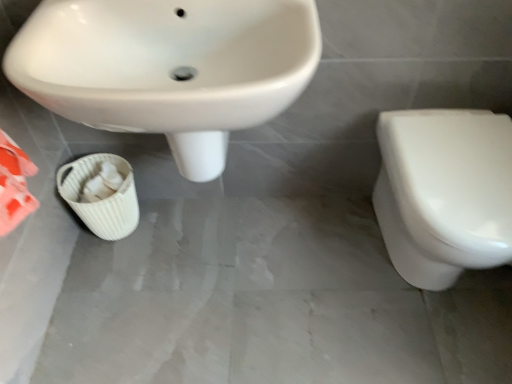
In order to click on white glossy toilet at right in this screenshot , I will do `click(444, 192)`.

At what (x,y) coordinates should I click in order to perform the action: click on white woven basket at lower left. Please return your answer as a coordinate pair (x, y). Looking at the image, I should click on (103, 199).

Find the location of a particular element. white glossy toilet at right is located at coordinates (444, 192).

Would you say white woven basket at lower left is outside white glossy toilet at right?

Absolutely, white woven basket at lower left is external to white glossy toilet at right.

Considering the positions of objects white woven basket at lower left and white glossy toilet at right in the image provided, who is more to the right, white woven basket at lower left or white glossy toilet at right?

white glossy toilet at right is more to the right.

Does white woven basket at lower left turn towards white glossy toilet at right?

No.

Is point (65, 197) positioned before point (429, 115)?

No.

From a real-world perspective, does white glossy toilet at right stand above white glossy sink at upper left?

Incorrect, from a real-world perspective, white glossy toilet at right is lower than white glossy sink at upper left.

The image size is (512, 384). Identify the location of toilet below the white glossy sink at upper left (from a real-world perspective). (444, 192).

Based on their sizes in the image, would you say white glossy toilet at right is bigger or smaller than white glossy sink at upper left?

Clearly, white glossy toilet at right is smaller in size than white glossy sink at upper left.

Is white woven basket at lower left aimed at white glossy sink at upper left?

No, white woven basket at lower left does not turn towards white glossy sink at upper left.

Is white woven basket at lower left in front of or behind white glossy sink at upper left in the image?

Clearly, white woven basket at lower left is behind white glossy sink at upper left.

Can you confirm if white woven basket at lower left is positioned to the right of white glossy sink at upper left?

No.

Which object is thinner, white woven basket at lower left or white glossy sink at upper left?

white woven basket at lower left is thinner.

Does point (445, 133) appear closer or farther from the camera than point (78, 216)?

Point (445, 133).

From the image's perspective, is white glossy toilet at right on white woven basket at lower left?

Incorrect, from the image's perspective, white glossy toilet at right is lower than white woven basket at lower left.

Locate an element on the screen. potty that is on the left side of white glossy toilet at right is located at coordinates (103, 199).

Which of these two, white glossy toilet at right or white woven basket at lower left, is smaller?

white woven basket at lower left is smaller.

From the image's perspective, is white glossy sink at upper left located above or below white glossy toilet at right?

Based on their image positions, white glossy sink at upper left is located above white glossy toilet at right.

Considering the relative sizes of white glossy sink at upper left and white glossy toilet at right in the image provided, is white glossy sink at upper left bigger than white glossy toilet at right?

Correct, white glossy sink at upper left is larger in size than white glossy toilet at right.

From a real-world perspective, is white glossy sink at upper left positioned above or below white glossy toilet at right?

Clearly, from a real-world perspective, white glossy sink at upper left is above white glossy toilet at right.

Is white glossy sink at upper left spatially inside white glossy toilet at right, or outside of it?

white glossy sink at upper left cannot be found inside white glossy toilet at right.

Is white glossy sink at upper left far away from white woven basket at lower left?

white glossy sink at upper left is near white woven basket at lower left, not far away.

From the image's perspective, between white glossy sink at upper left and white woven basket at lower left, which one is located above?

white glossy sink at upper left.

Is white glossy sink at upper left closer to camera compared to white woven basket at lower left?

Yes.

The height and width of the screenshot is (384, 512). Identify the location of potty below the white glossy sink at upper left (from the image's perspective). (103, 199).

Where is `potty behind the white glossy toilet at right`? Image resolution: width=512 pixels, height=384 pixels. potty behind the white glossy toilet at right is located at coordinates (103, 199).

The width and height of the screenshot is (512, 384). Find the location of `toilet that appears below the white glossy sink at upper left (from a real-world perspective)`. toilet that appears below the white glossy sink at upper left (from a real-world perspective) is located at coordinates (444, 192).

Considering their positions, is white glossy toilet at right positioned closer to white woven basket at lower left than white glossy sink at upper left?

The object closer to white woven basket at lower left is white glossy sink at upper left.

From the image, which object appears to be nearer to white glossy toilet at right, white woven basket at lower left or white glossy sink at upper left?

white glossy sink at upper left is positioned closer to the anchor white glossy toilet at right.

Considering their positions, is white glossy sink at upper left positioned closer to white woven basket at lower left than white glossy toilet at right?

Based on the image, white glossy sink at upper left appears to be nearer to white woven basket at lower left.

Based on their spatial positions, is white woven basket at lower left or white glossy toilet at right closer to white glossy sink at upper left?

white woven basket at lower left is positioned closer to the anchor white glossy sink at upper left.

Based on their spatial positions, is white glossy sink at upper left or white woven basket at lower left closer to white glossy toilet at right?

white glossy sink at upper left.

Estimate the real-world distances between objects in this image. Which object is further from white glossy sink at upper left, white glossy toilet at right or white woven basket at lower left?

Based on the image, white glossy toilet at right appears to be further to white glossy sink at upper left.

The width and height of the screenshot is (512, 384). I want to click on sink situated between white woven basket at lower left and white glossy toilet at right from left to right, so click(x=168, y=67).